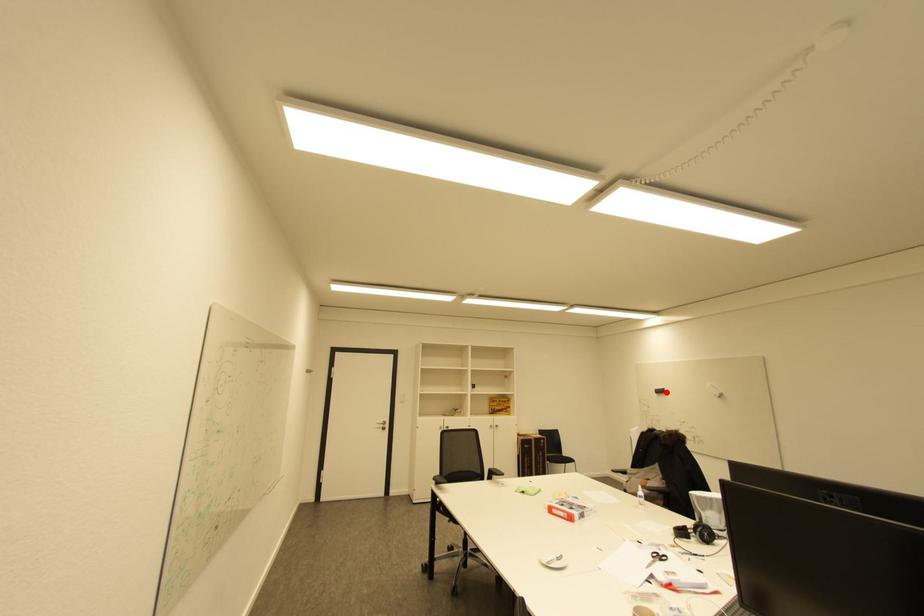
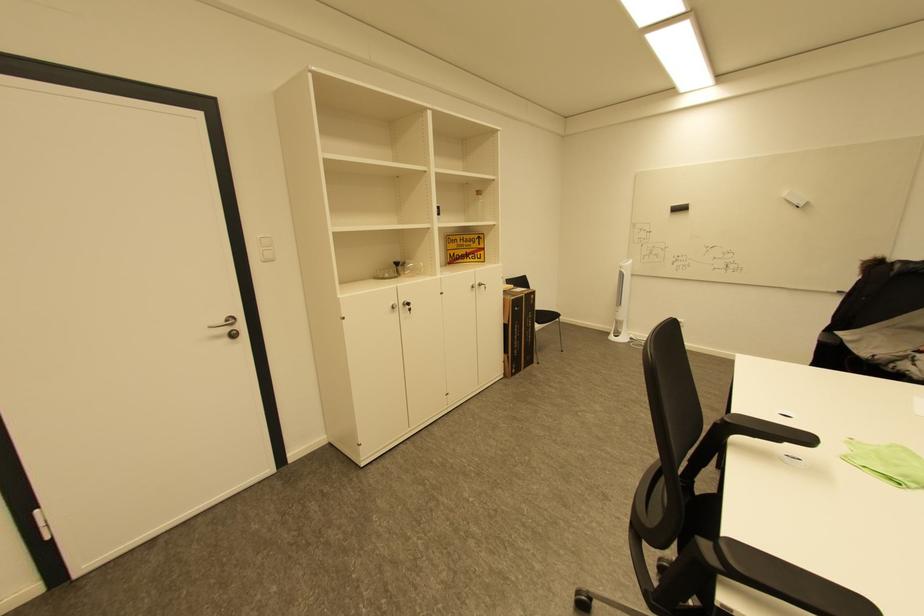
Find the pixel in the second image that matches the highlighted location in the first image.

(686, 209)